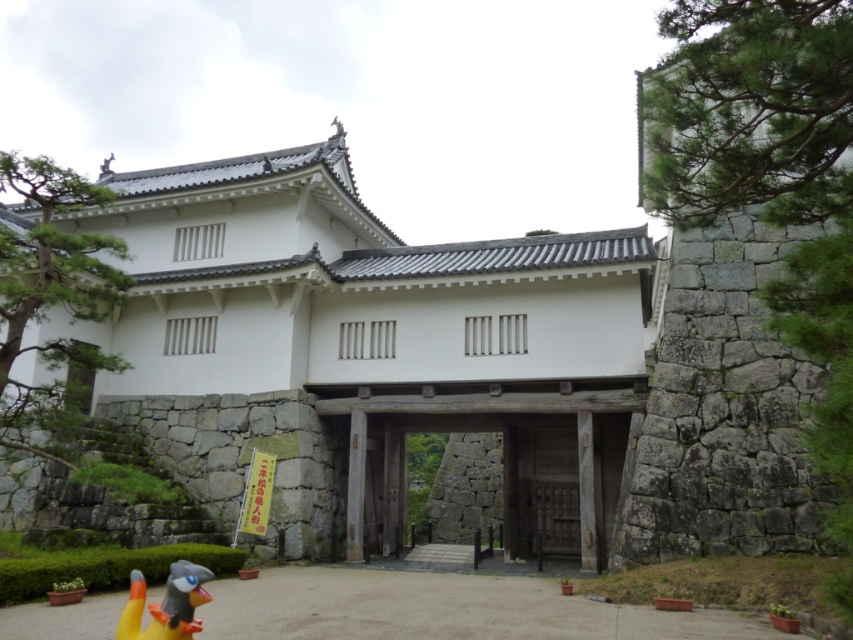
You are standing in front of the traditional Japanese castle gate and notice a green stone tree at upper left. Can you determine its exact position relative to the gate?

The green stone tree at upper left is located at point coordinates of 0.463 on the x axis and 0.060 on the y axis.